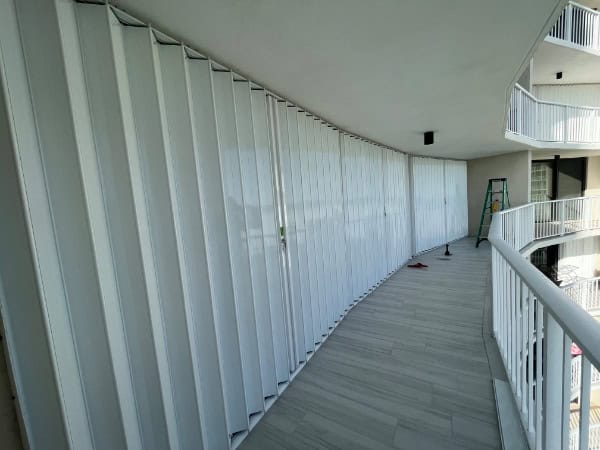
Where is `blinds`? blinds is located at coordinates (121, 180), (332, 251), (369, 219), (397, 196), (428, 181), (454, 179).